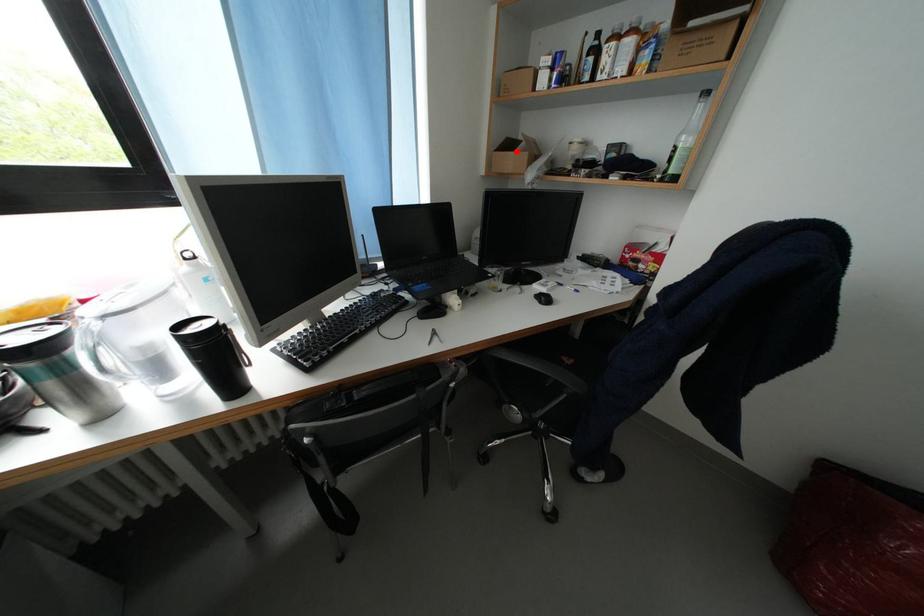
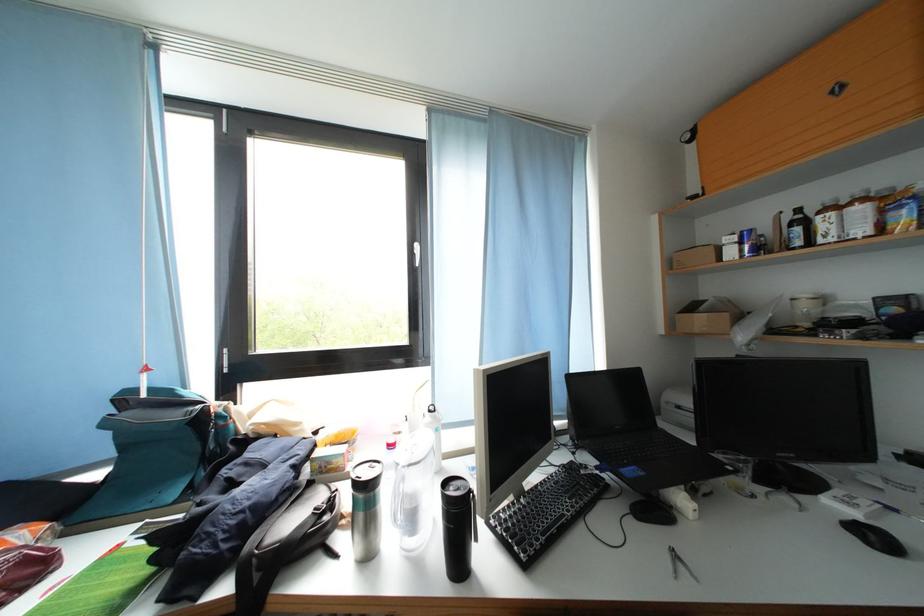
Locate, in the second image, the point that corresponds to the highlighted location in the first image.

(700, 312)